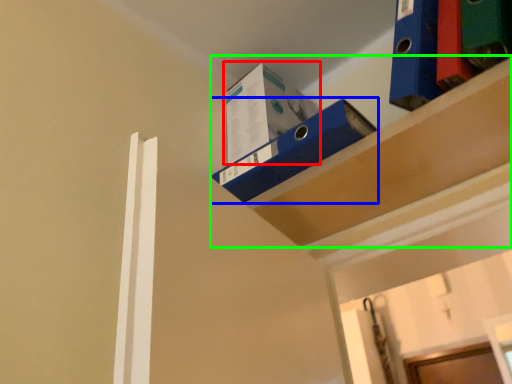
Question: Considering the real-world distances, which object is farthest from box (highlighted by a red box)? shelf (highlighted by a blue box) or shelf (highlighted by a green box)?

Choices:
 (A) shelf
 (B) shelf

Answer: (B)